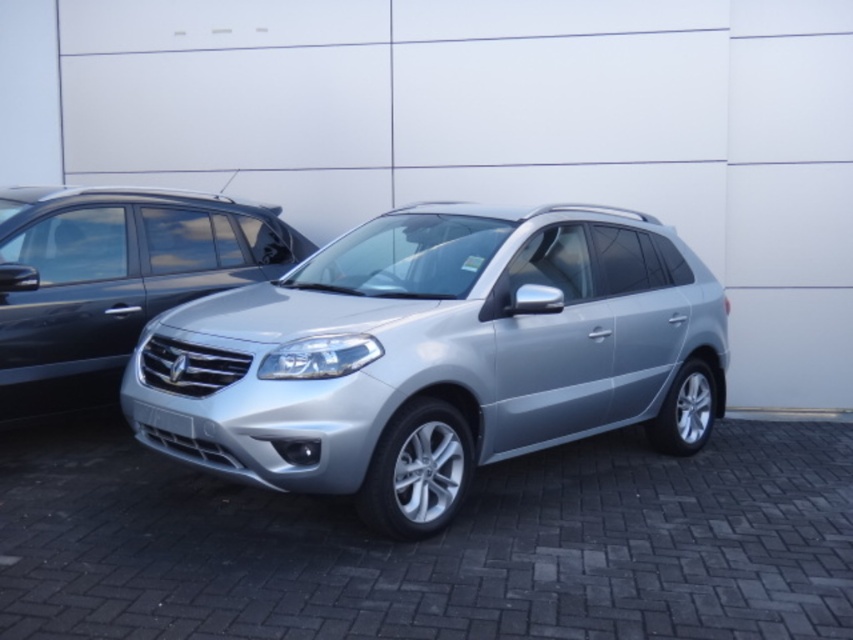
You are a parking attendant and need to guide a driver to park their car between the satin silver suv at center and the satin silver minivan at left. Based on their current positions, is there enough space between them to fit another car?

The satin silver suv at center is located below the satin silver minivan at left, so there is likely sufficient vertical space between them to accommodate another vehicle.

Based on the photo, you are a parking attendant and need to park a new car that requires a space for a large vehicle. You see the satin silver suv at center and the satin silver minivan at left. Which vehicle should you choose to park the new car next to?

The satin silver suv at center is larger in size than the satin silver minivan at left, so you should park the new car next to the satin silver suv at center since it indicates a space suitable for large vehicles.